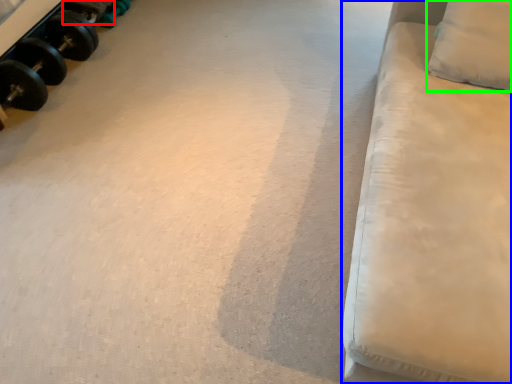
Question: Based on their relative distances, which object is farther from dumbbell (highlighted by a red box)? Choose from furniture (highlighted by a blue box) and pillow (highlighted by a green box).

Choices:
 (A) furniture
 (B) pillow

Answer: (A)